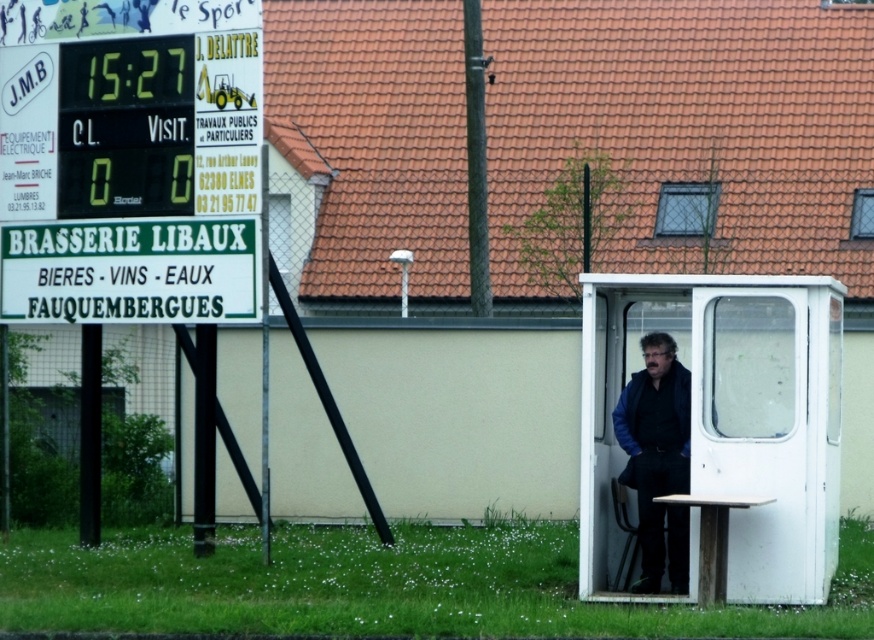
Question: Among these points, which one is farthest from the camera?

Choices:
 (A) (105, 65)
 (B) (802, 572)

Answer: (A)

Question: Is white plastic booth at center below dark blue jacket at center?

Choices:
 (A) no
 (B) yes

Answer: (A)

Question: Which is nearer to the dark blue jacket at center?

Choices:
 (A) yellow digital scoreboard at left
 (B) white plastic booth at center

Answer: (B)

Question: Observing the image, what is the correct spatial positioning of white plastic booth at center in reference to dark blue jacket at center?

Choices:
 (A) below
 (B) above

Answer: (B)

Question: Does white plastic booth at center have a smaller size compared to dark blue jacket at center?

Choices:
 (A) no
 (B) yes

Answer: (A)

Question: Which of these objects is positioned farthest from the yellow digital scoreboard at left?

Choices:
 (A) dark blue jacket at center
 (B) white plastic booth at center

Answer: (B)